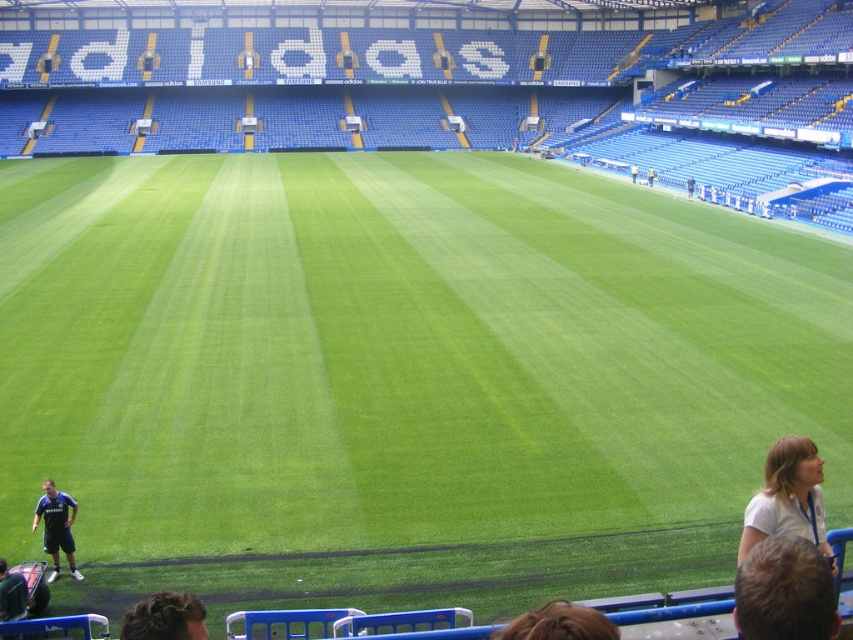
Question: Among these objects, which one is farthest from the camera?

Choices:
 (A) white matte shirt at lower right
 (B) brown hair at lower center

Answer: (A)

Question: From the image, what is the correct spatial relationship of blonde hair at lower right in relation to white matte shirt at lower right?

Choices:
 (A) right
 (B) left

Answer: (B)

Question: Which object is positioned closest to the white matte shirt at lower right?

Choices:
 (A) brown hair at lower center
 (B) blonde hair at lower right
 (C) curly hair at lower left
 (D) blue jersey at lower left

Answer: (B)

Question: Which object is the closest to the blonde hair at lower right?

Choices:
 (A) white matte shirt at lower right
 (B) blue jersey at lower left

Answer: (A)

Question: Can you confirm if blonde hair at lower right is wider than curly hair at lower left?

Choices:
 (A) yes
 (B) no

Answer: (A)

Question: Is white matte shirt at lower right closer to camera compared to brown hair at lower center?

Choices:
 (A) no
 (B) yes

Answer: (A)